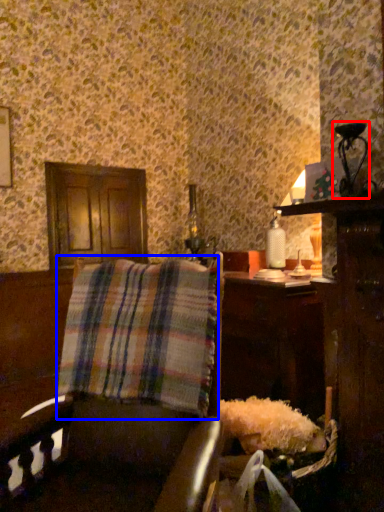
Question: Which object appears farthest to the camera in this image, table lamp (highlighted by a red box) or plaid (highlighted by a blue box)?

Choices:
 (A) table lamp
 (B) plaid

Answer: (A)